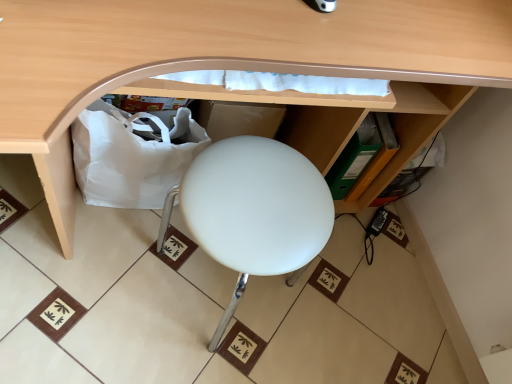
Where is `empty space that is ontop of white fabric bag at lower left (from a real-world perspective)`? This screenshot has width=512, height=384. empty space that is ontop of white fabric bag at lower left (from a real-world perspective) is located at coordinates (156, 114).